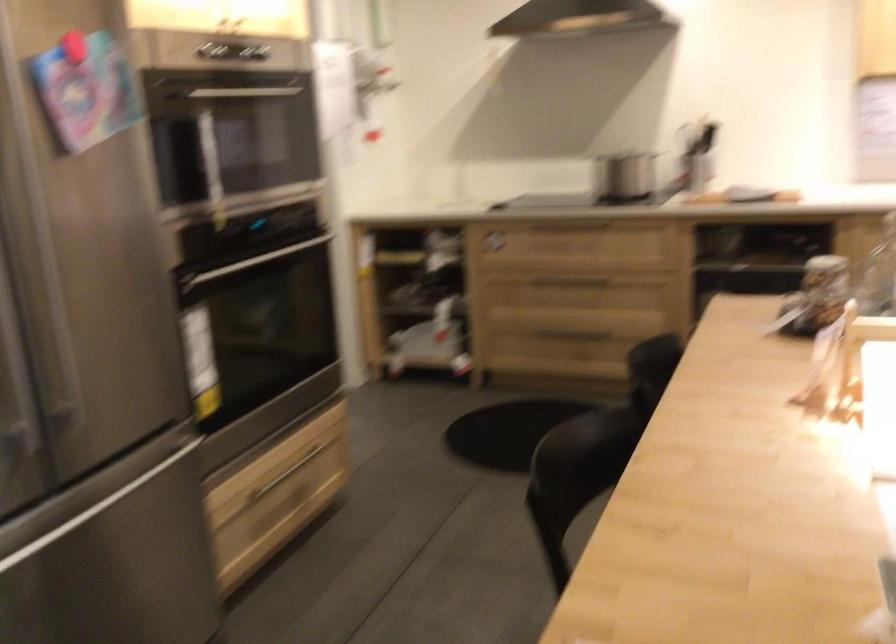
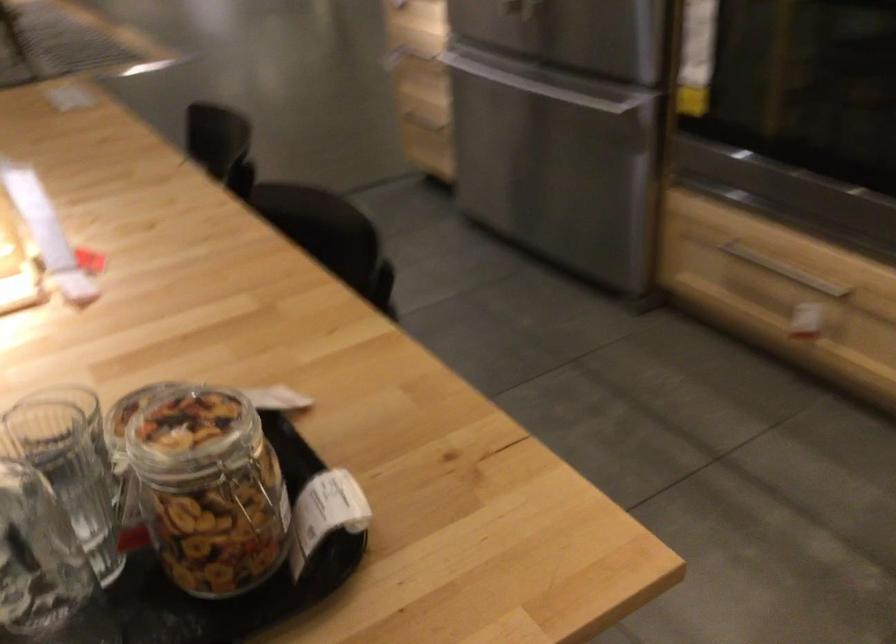
The point at (805, 275) is marked in the first image. Where is the corresponding point in the second image?

(250, 493)